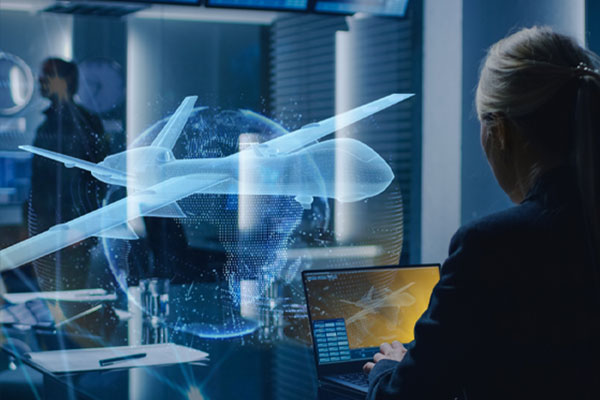
Find the location of a particular element. laptop is located at coordinates (331, 370).